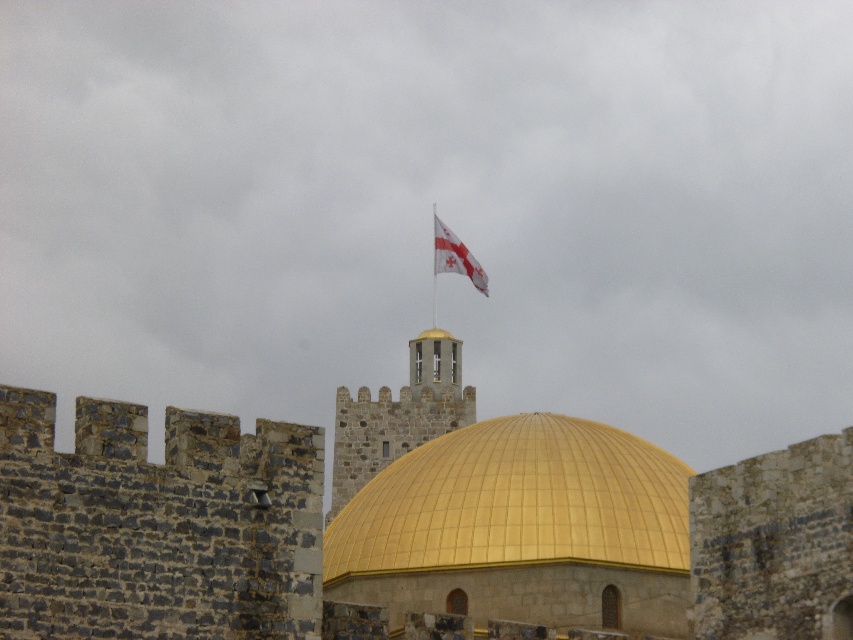
Does gold metallic dome at center have a larger size compared to white fabric flag at upper center?

Correct, gold metallic dome at center is larger in size than white fabric flag at upper center.

The height and width of the screenshot is (640, 853). What do you see at coordinates (515, 500) in the screenshot? I see `gold metallic dome at center` at bounding box center [515, 500].

Does point (590, 493) come behind point (456, 241)?

No, it is not.

The width and height of the screenshot is (853, 640). Identify the location of gold metallic dome at center. point(515,500).